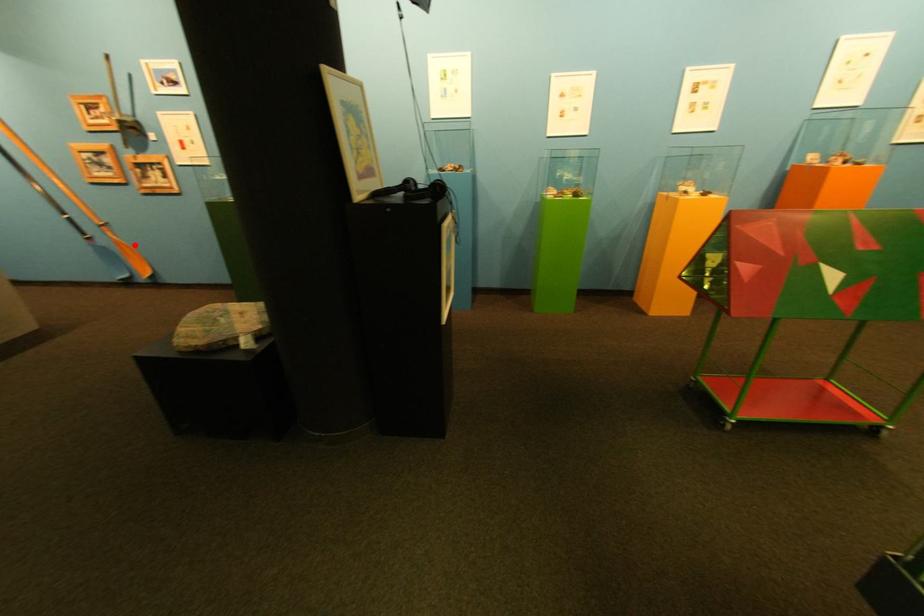
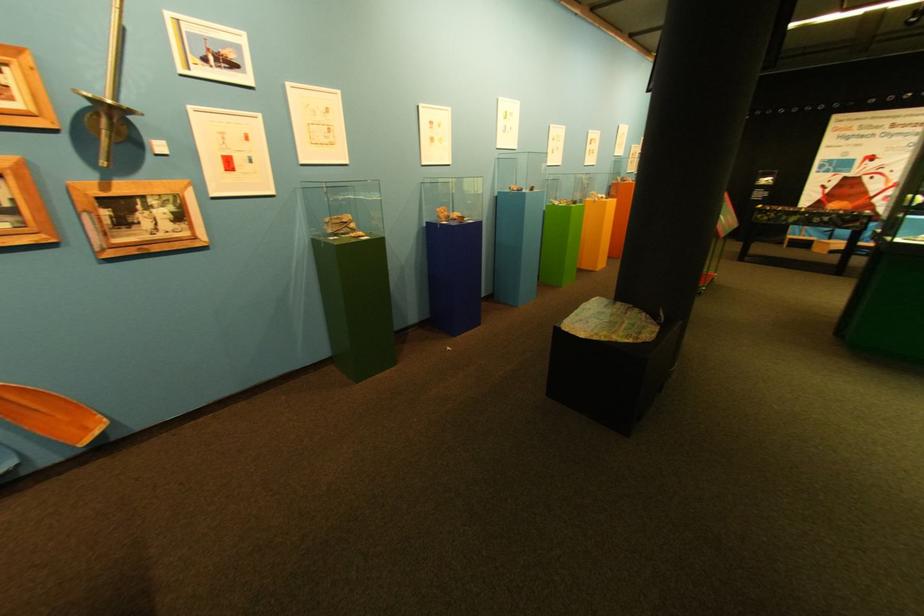
Locate, in the second image, the point that corresponds to the highlighted location in the first image.

(6, 397)